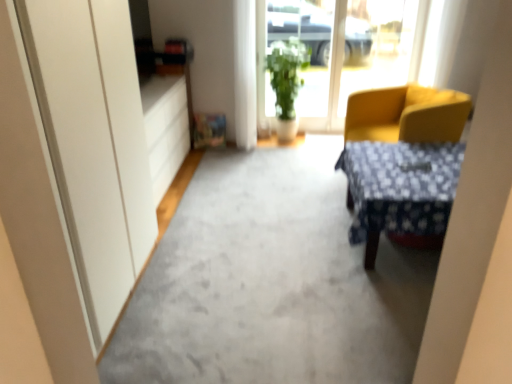
You are a GUI agent. You are given a task and a screenshot of the screen. Output one action in this format:
    pyautogui.click(x=<x>, y=<y>)
    Task: Click on the free space below gray carpet at center (from a real-world perspective)
    
    Given the screenshot: What is the action you would take?
    pyautogui.click(x=262, y=242)